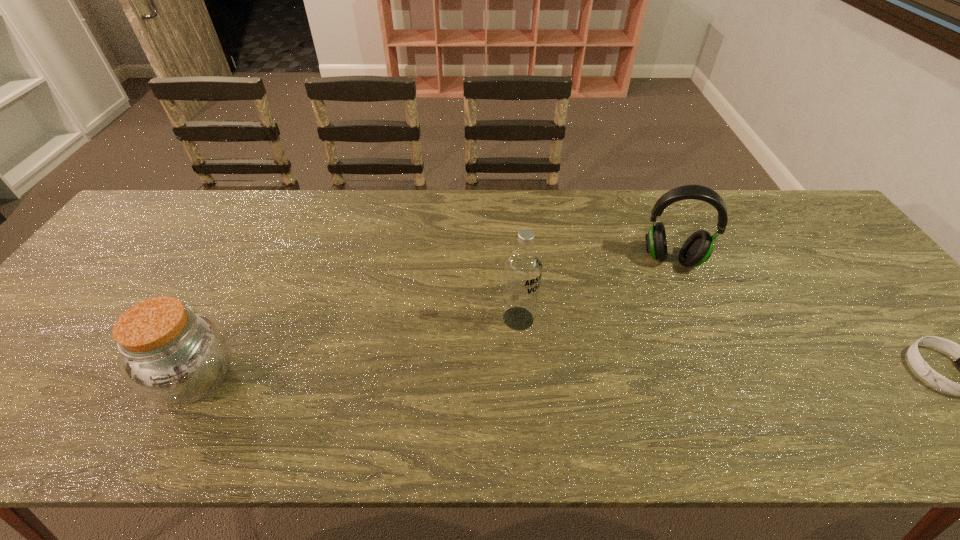
Where is `free space located on the ear cups of the headset`? The width and height of the screenshot is (960, 540). free space located on the ear cups of the headset is located at coordinates (668, 302).

The image size is (960, 540). What are the coordinates of `free region located 0.170m on the ear cups of the headset` in the screenshot? It's located at (667, 322).

Find the location of `object situated at the near edge`. object situated at the near edge is located at coordinates click(x=169, y=353).

Locate an element on the screen. vacant area at the far edge of the desktop is located at coordinates (718, 192).

In the image, there is a desktop. In order to click on vacant area at the near edge in this screenshot , I will do `click(256, 373)`.

What are the coordinates of `vacant space at the left edge` in the screenshot? It's located at (57, 349).

This screenshot has width=960, height=540. I want to click on vacant space at the right edge of the desktop, so click(840, 265).

Identify the location of vacant space at the far left corner. This screenshot has height=540, width=960. (165, 228).

Where is `free space at the far right corner of the desktop`? free space at the far right corner of the desktop is located at coordinates (793, 210).

Where is `empty space between the headset and the vodka`? Image resolution: width=960 pixels, height=540 pixels. empty space between the headset and the vodka is located at coordinates (595, 289).